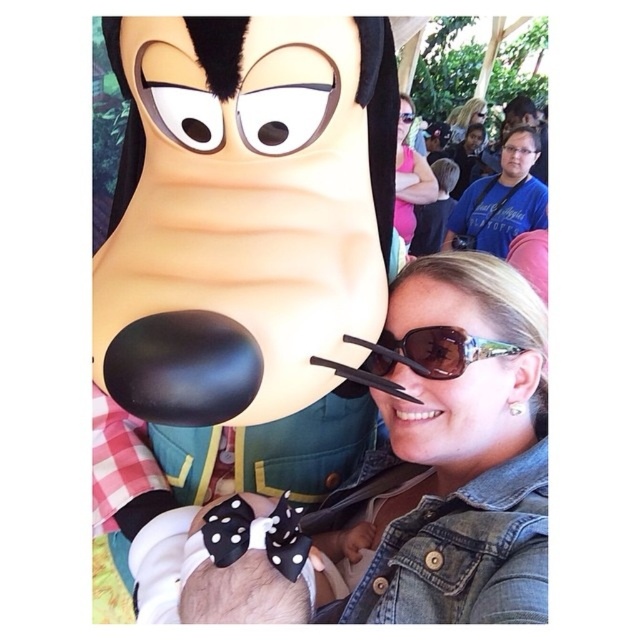
You are designing a costume for a play and need to choose between the black polka dot bow at center and the black dotted fabric bow tie at lower center. Which one should you pick if you want the accessory to be more eye catching due to its size?

The black polka dot bow at center is larger in width than the black dotted fabric bow tie at lower center, so it would be more eye catching due to its larger size.